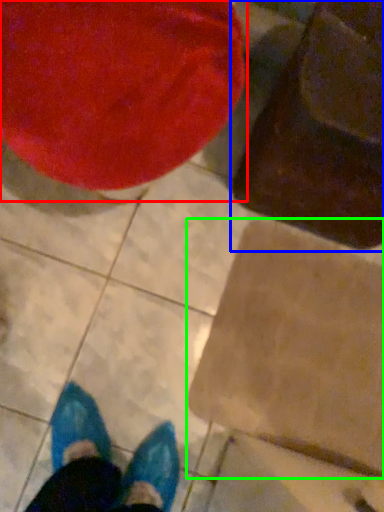
Question: Considering the real-world distances, which object is closest to bean bag chair (highlighted by a red box)? bean bag chair (highlighted by a blue box) or cardboard box (highlighted by a green box).

Choices:
 (A) bean bag chair
 (B) cardboard box

Answer: (A)